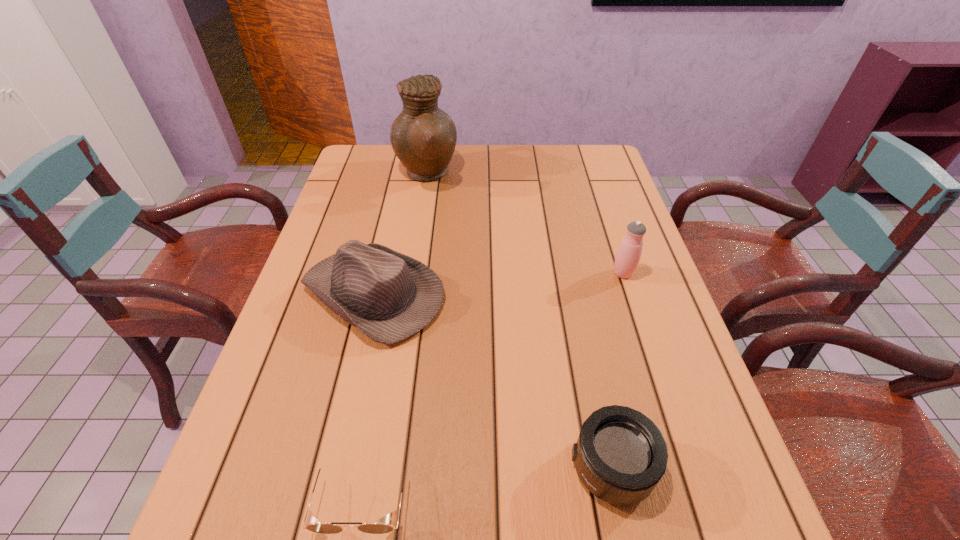
Find the location of a particular element. The width and height of the screenshot is (960, 540). blank space that satisfies the following two spatial constraints: 1. at the spout of the thermos bottle; 2. on the right side of the pitcher is located at coordinates (411, 273).

Image resolution: width=960 pixels, height=540 pixels. In order to click on free region that satisfies the following two spatial constraints: 1. on the back side of the second tallest object; 2. at the spout of the tallest object in this screenshot , I will do `click(590, 174)`.

This screenshot has width=960, height=540. I want to click on vacant region that satisfies the following two spatial constraints: 1. at the spout of the fourth shortest object; 2. on the right side of the pitcher, so click(x=411, y=273).